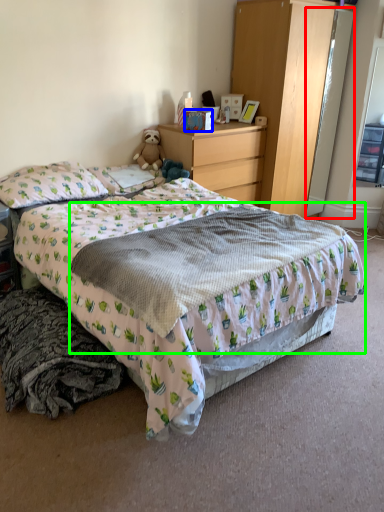
Question: Which object is the closest to the mirror (highlighted by a red box)? Choose among these: box (highlighted by a blue box) or blanket (highlighted by a green box).

Choices:
 (A) box
 (B) blanket

Answer: (A)